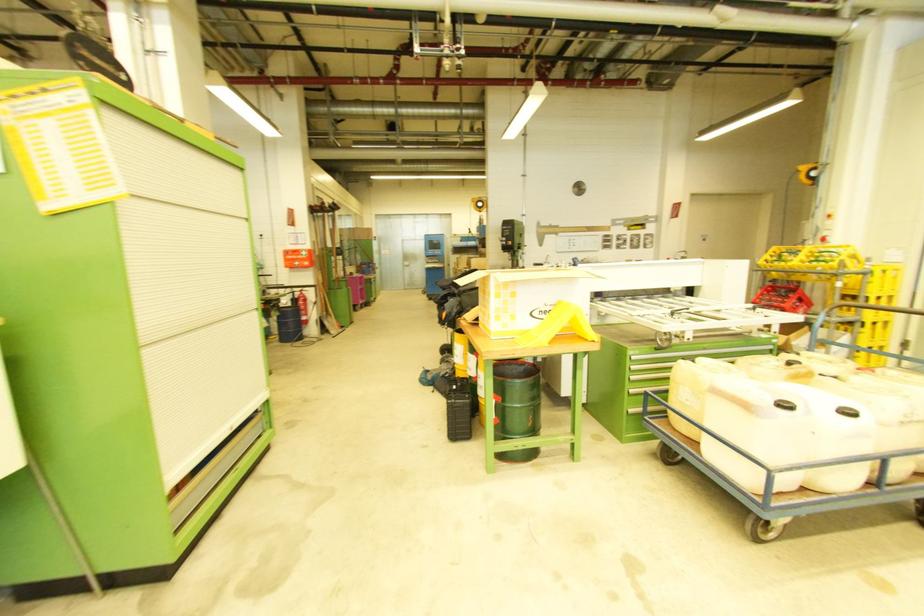
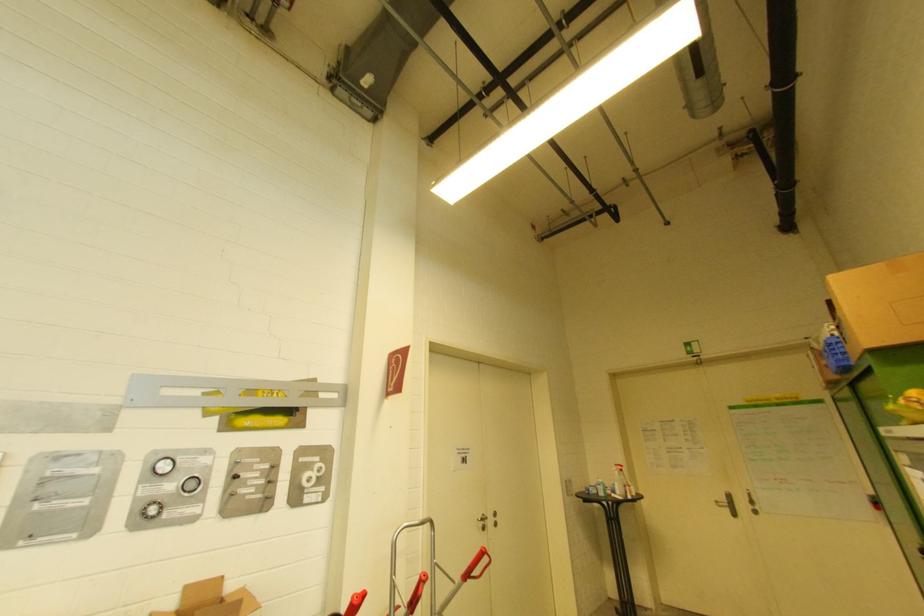
In the second image, find the point that corresponds to (621,249) in the first image.

(149, 517)